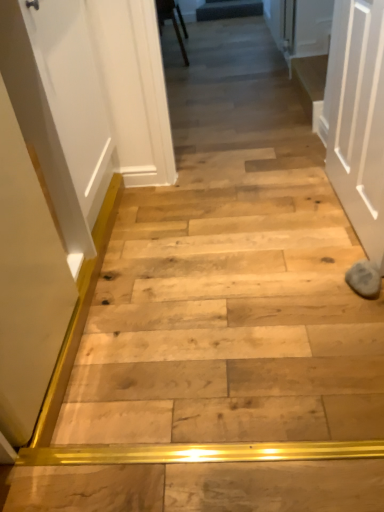
At what (x,y) coordinates should I click in order to perform the action: click on vacant location behind white matte door at right. Please return your answer as a coordinate pair (x, y). The image size is (384, 512). Looking at the image, I should click on (293, 185).